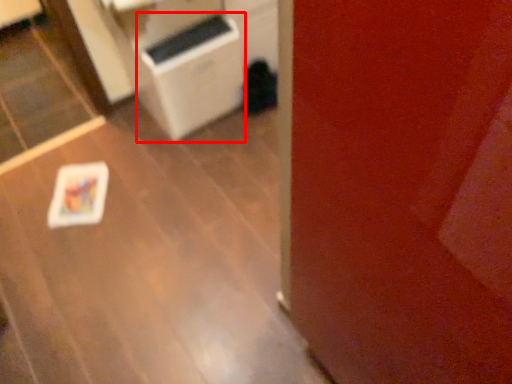
Question: From the image's perspective, considering the relative positions of appliance (annotated by the red box) and table in the image provided, where is appliance (annotated by the red box) located with respect to the staircase?

Choices:
 (A) below
 (B) above

Answer: (B)